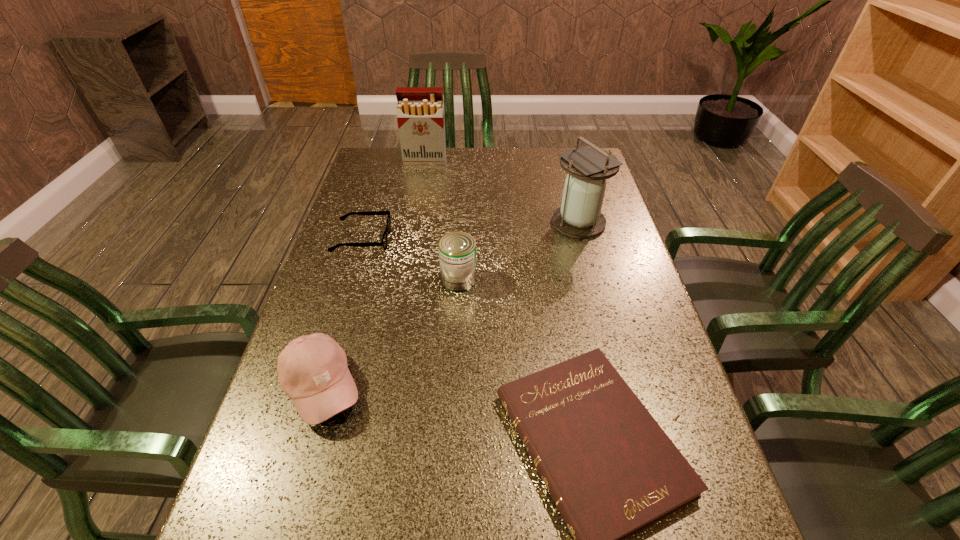
Where is `free space located 0.180m on the arms of the second shortest object`? The width and height of the screenshot is (960, 540). free space located 0.180m on the arms of the second shortest object is located at coordinates (451, 240).

I want to click on object that is at the far edge, so click(x=420, y=113).

Where is `cigarette case at the left edge`? cigarette case at the left edge is located at coordinates (x=420, y=113).

Identify the location of baseball cap that is at the left edge. (312, 370).

Identify the location of spectacles at the left edge. (383, 243).

Identify the location of object located at the right edge. Image resolution: width=960 pixels, height=540 pixels. (579, 216).

Find the location of a particular element. The image size is (960, 540). object that is at the far left corner is located at coordinates (420, 113).

Find the location of `free space at the far edge of the desktop`. free space at the far edge of the desktop is located at coordinates (523, 174).

Find the location of a particular element. The width and height of the screenshot is (960, 540). free location at the left edge is located at coordinates point(363,323).

In the image, there is a desktop. In order to click on vacant space at the right edge in this screenshot , I will do `click(596, 257)`.